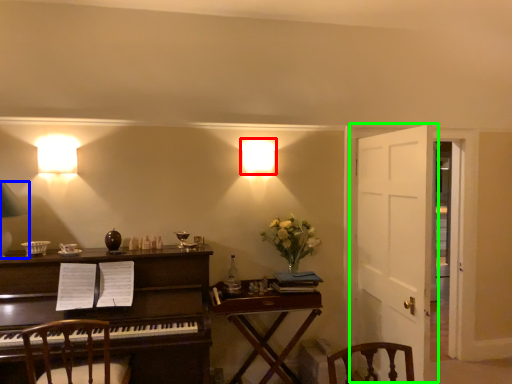
Question: Which object is the farthest from lamp (highlighted by a red box)? Choose among these: lamp (highlighted by a blue box) or door (highlighted by a green box).

Choices:
 (A) lamp
 (B) door

Answer: (A)